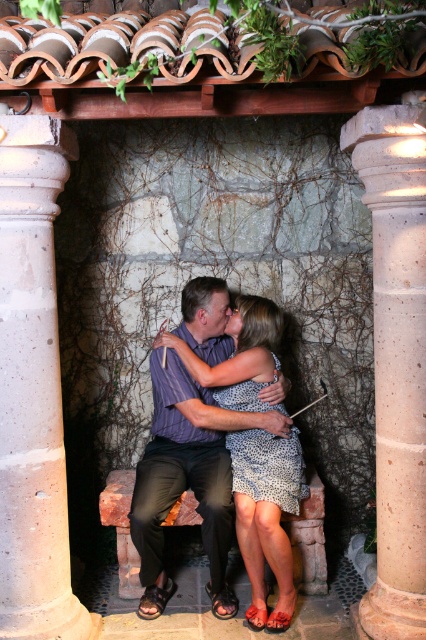
Is speckled stone column at right closer to the viewer compared to matte purple shirt at center?

Yes.

Which is behind, point (363, 140) or point (175, 392)?

Point (175, 392)

Locate an element on the screen. The width and height of the screenshot is (426, 640). speckled stone column at right is located at coordinates (396, 360).

Can you confirm if white concrete column at left is taller than speckled stone column at right?

Incorrect, white concrete column at left's height is not larger of speckled stone column at right's.

Is point (11, 198) behind point (402, 452)?

No, (11, 198) is in front of (402, 452).

Where is `white concrete column at left`? This screenshot has width=426, height=640. white concrete column at left is located at coordinates (32, 388).

Between point (60, 138) and point (230, 529), which one is positioned in front?

Positioned in front is point (60, 138).

Locate an element on the screen. Image resolution: width=426 pixels, height=640 pixels. white concrete column at left is located at coordinates (32, 388).